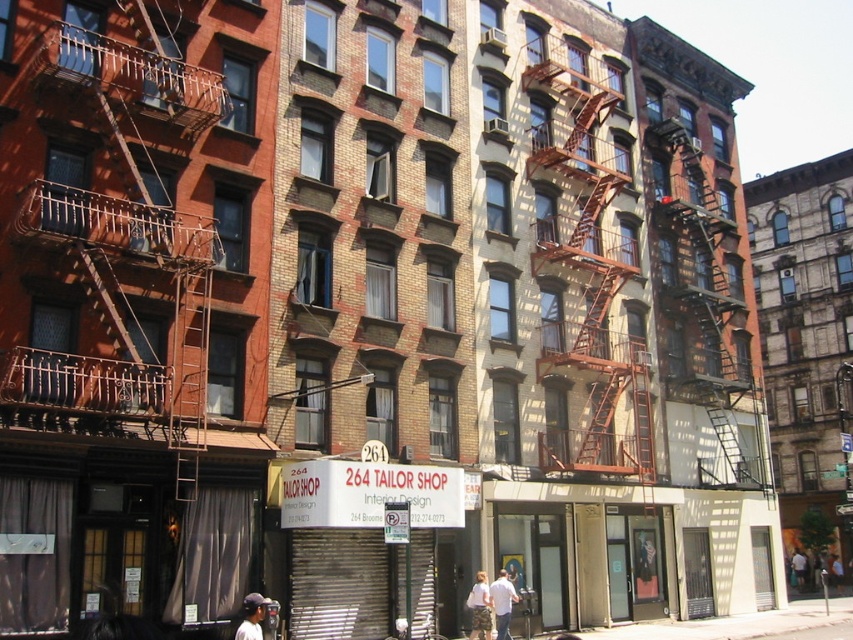
What do you see at coordinates (590, 272) in the screenshot? I see `rusty metal fire escape at center` at bounding box center [590, 272].

Which is more to the left, rusty metal fire escape at center or matte black baseball cap at lower left?

Positioned to the left is matte black baseball cap at lower left.

Is point (585, 102) positioned before point (241, 621)?

That is False.

Locate an element on the screen. Image resolution: width=853 pixels, height=640 pixels. rusty metal fire escape at center is located at coordinates (590, 272).

The width and height of the screenshot is (853, 640). What do you see at coordinates (251, 616) in the screenshot? I see `matte black baseball cap at lower left` at bounding box center [251, 616].

Between point (252, 621) and point (833, 563), which one is positioned behind?

The point (833, 563) is more distant.

The height and width of the screenshot is (640, 853). I want to click on matte black baseball cap at lower left, so pyautogui.click(x=251, y=616).

What are the coordinates of `matte black baseball cap at lower left` in the screenshot? It's located at (251, 616).

Who is shorter, light brown textured shorts at lower center or matte black baseball cap at lower left?

light brown textured shorts at lower center

Does point (479, 614) come behind point (254, 608)?

Yes, it is.

Locate an element on the screen. light brown textured shorts at lower center is located at coordinates (480, 608).